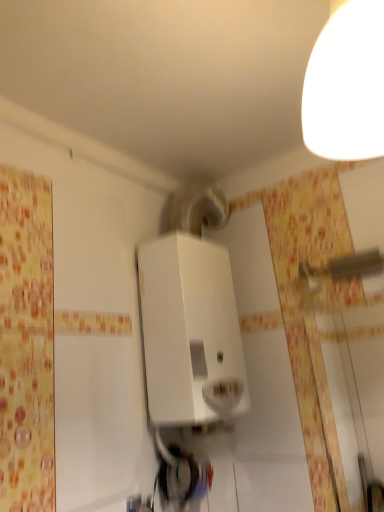
The image size is (384, 512). Describe the element at coordinates (190, 332) in the screenshot. I see `white matte water heater at center` at that location.

Locate an element on the screen. The image size is (384, 512). white matte water heater at center is located at coordinates point(190,332).

The height and width of the screenshot is (512, 384). Describe the element at coordinates (346, 85) in the screenshot. I see `white glossy lampshade at upper right` at that location.

What is the approximate height of white glossy lampshade at upper right?

It is 16.72 inches.

Locate an element on the screen. white glossy lampshade at upper right is located at coordinates (346, 85).

The height and width of the screenshot is (512, 384). What are the coordinates of `white matte water heater at center` in the screenshot? It's located at (190, 332).

Which is more to the right, white matte water heater at center or white glossy lampshade at upper right?

white glossy lampshade at upper right.

Does white matte water heater at center lie in front of white glossy lampshade at upper right?

No, it is behind white glossy lampshade at upper right.

From the picture: Which is closer, (152, 306) or (362, 41)?

The point (362, 41) is more forward.

From the image's perspective, does white matte water heater at center appear lower than white glossy lampshade at upper right?

Indeed, from the image's perspective, white matte water heater at center is shown beneath white glossy lampshade at upper right.

From a real-world perspective, is white matte water heater at center physically above white glossy lampshade at upper right?

Incorrect, from a real-world perspective, white matte water heater at center is lower than white glossy lampshade at upper right.

Considering the sizes of white matte water heater at center and white glossy lampshade at upper right in the image, is white matte water heater at center wider or thinner than white glossy lampshade at upper right?

In the image, white matte water heater at center appears to be more narrow than white glossy lampshade at upper right.

Considering the sizes of objects white matte water heater at center and white glossy lampshade at upper right in the image provided, who is taller, white matte water heater at center or white glossy lampshade at upper right?

white matte water heater at center is taller.

Considering the relative sizes of white matte water heater at center and white glossy lampshade at upper right in the image provided, is white matte water heater at center bigger than white glossy lampshade at upper right?

Yes.

Is white glossy lampshade at upper right surrounded by white matte water heater at center?

That's incorrect, white glossy lampshade at upper right is not inside white matte water heater at center.

Is white matte water heater at center beside white glossy lampshade at upper right?

There is a gap between white matte water heater at center and white glossy lampshade at upper right.

Is white matte water heater at center aimed at white glossy lampshade at upper right?

No, white matte water heater at center is not turned towards white glossy lampshade at upper right.

How many degrees apart are the facing directions of white matte water heater at center and white glossy lampshade at upper right?

The angular difference between white matte water heater at center and white glossy lampshade at upper right is 87.6 degrees.

The image size is (384, 512). In order to click on light fixture on the right of white matte water heater at center in this screenshot , I will do `click(346, 85)`.

Which object is positioned more to the left, white glossy lampshade at upper right or white matte water heater at center?

white matte water heater at center is more to the left.

Which object is closer to the camera taking this photo, white glossy lampshade at upper right or white matte water heater at center?

white glossy lampshade at upper right is in front.

Does point (351, 148) lie behind point (155, 302)?

No, it is in front of (155, 302).

From the image's perspective, who appears lower, white glossy lampshade at upper right or white matte water heater at center?

white matte water heater at center.

From a real-world perspective, between white glossy lampshade at upper right and white matte water heater at center, who is vertically lower?

In real-world perspective, white matte water heater at center is lower.

Is white glossy lampshade at upper right thinner than white matte water heater at center?

No.

Which of these two, white glossy lampshade at upper right or white matte water heater at center, stands shorter?

white glossy lampshade at upper right.

Which of these two, white glossy lampshade at upper right or white matte water heater at center, is bigger?

white matte water heater at center is bigger.

Is white glossy lampshade at upper right not inside white matte water heater at center?

Absolutely, white glossy lampshade at upper right is external to white matte water heater at center.

Are white glossy lampshade at upper right and white matte water heater at center located far from each other?

No, white glossy lampshade at upper right is not far from white matte water heater at center.

Is white glossy lampshade at upper right oriented away from white matte water heater at center?

white glossy lampshade at upper right is not turned away from white matte water heater at center.

How different are the orientations of white glossy lampshade at upper right and white matte water heater at center in degrees?

The angular difference between white glossy lampshade at upper right and white matte water heater at center is 87.6 degrees.

Where is `appliance below the white glossy lampshade at upper right (from the image's perspective)`? Image resolution: width=384 pixels, height=512 pixels. appliance below the white glossy lampshade at upper right (from the image's perspective) is located at coordinates (190, 332).

The image size is (384, 512). Identify the location of appliance on the left of the white glossy lampshade at upper right. (190, 332).

At what (x,y) coordinates should I click in order to perform the action: click on light fixture above the white matte water heater at center (from a real-world perspective). Please return your answer as a coordinate pair (x, y). Looking at the image, I should click on (346, 85).